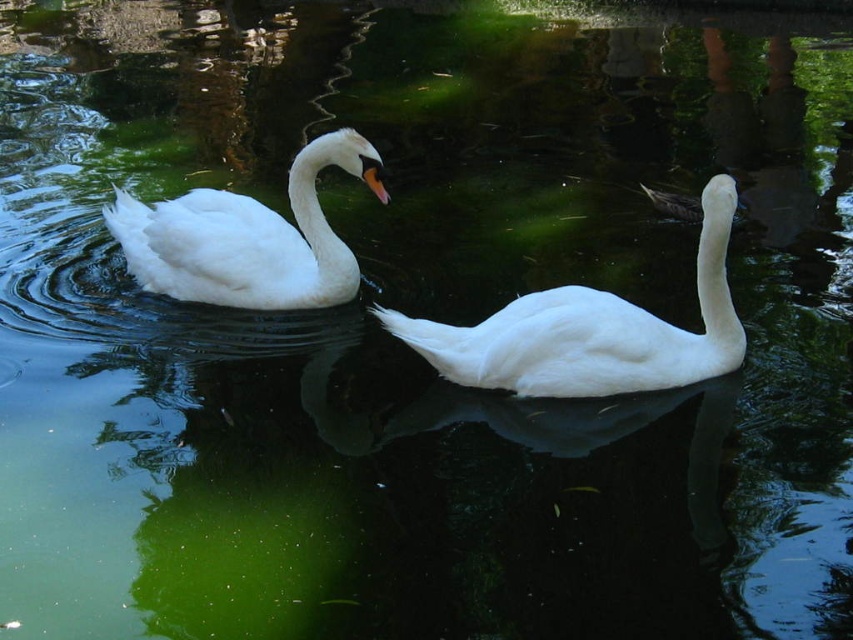
Question: Among these points, which one is nearest to the camera?

Choices:
 (A) (225, 236)
 (B) (665, 387)

Answer: (B)

Question: Does white matte swan at center come behind white glossy swan at upper left?

Choices:
 (A) no
 (B) yes

Answer: (A)

Question: Does white matte swan at center have a smaller size compared to white glossy swan at upper left?

Choices:
 (A) no
 (B) yes

Answer: (B)

Question: Which object appears farthest from the camera in this image?

Choices:
 (A) white glossy swan at upper left
 (B) white matte swan at center

Answer: (A)

Question: Does white matte swan at center appear under white glossy swan at upper left?

Choices:
 (A) no
 (B) yes

Answer: (B)